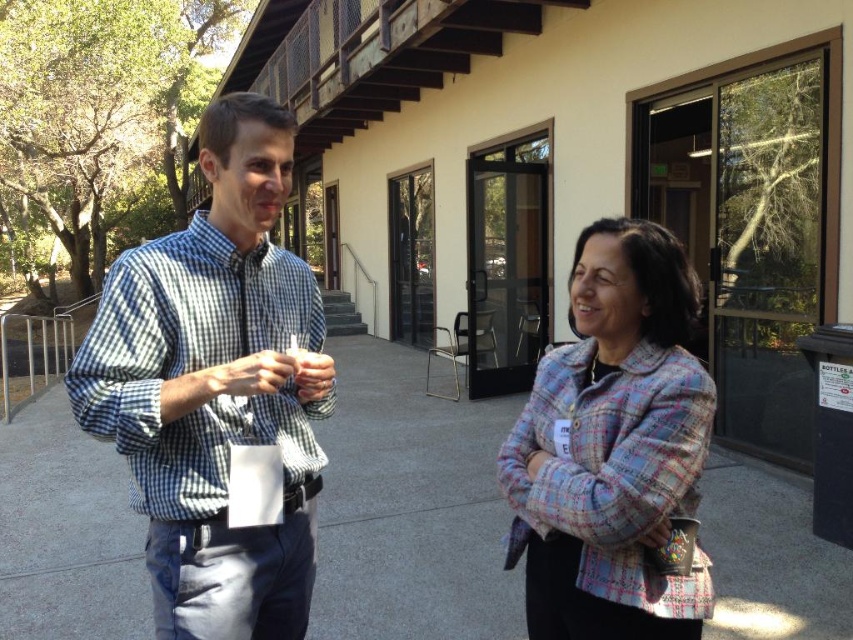
Question: Considering the real-world distances, which object is farthest from the checkered fabric shirt at left?

Choices:
 (A) plaid fabric jacket at center
 (B) blue checkered shirt at left

Answer: (B)

Question: Does blue checkered shirt at left come behind checkered fabric shirt at left?

Choices:
 (A) no
 (B) yes

Answer: (A)

Question: Which of the following is the farthest from the observer?

Choices:
 (A) blue checkered shirt at left
 (B) checkered fabric shirt at left

Answer: (B)

Question: Considering the relative positions of blue checkered shirt at left and checkered fabric shirt at left in the image provided, where is blue checkered shirt at left located with respect to checkered fabric shirt at left?

Choices:
 (A) right
 (B) left

Answer: (A)

Question: Is checkered fabric shirt at left positioned in front of plaid fabric jacket at center?

Choices:
 (A) no
 (B) yes

Answer: (A)

Question: Which is nearer to the checkered fabric shirt at left?

Choices:
 (A) plaid fabric jacket at center
 (B) blue checkered shirt at left

Answer: (A)